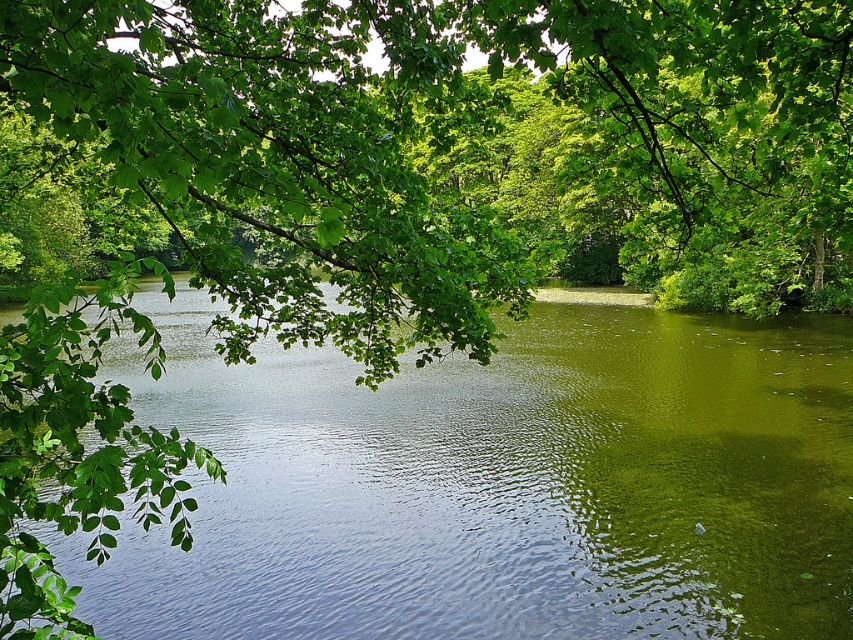
You are a photographer trying to capture a clear shot of both the green leafy branch at upper center and the green smooth water at center. Given that your camera has a depth of field that can focus on objects within a 5 meter range, will both objects be in focus simultaneously?

The distance between the green leafy branch at upper center and the green smooth water at center is 6.33 meters, which exceeds the camera lens depth of field range of 5 meters. Therefore, both objects cannot be in focus at the same time.

You are an artist sketching the scene. You need to decide which object to draw first based on their size. Which one should you start with, the green leafy branch at upper center or the green smooth water at center?

The green leafy branch at upper center is larger in size than the green smooth water at center, so you should start drawing the green leafy branch at upper center first.

You are an artist trying to sketch this scene. You want to ensure the green leafy branch at upper center and the green smooth water at center are proportionally accurate. Which one should you draw wider?

The green smooth water at center is wider than the green leafy branch at upper center, so you should draw the green smooth water at center wider.